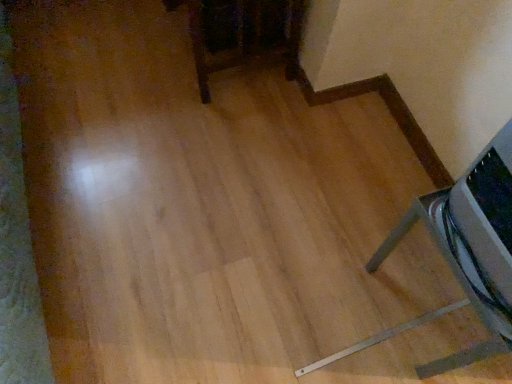
The height and width of the screenshot is (384, 512). I want to click on free spot in front of dark wood table at upper center, which is counted as the first furniture, starting from the top, so click(206, 141).